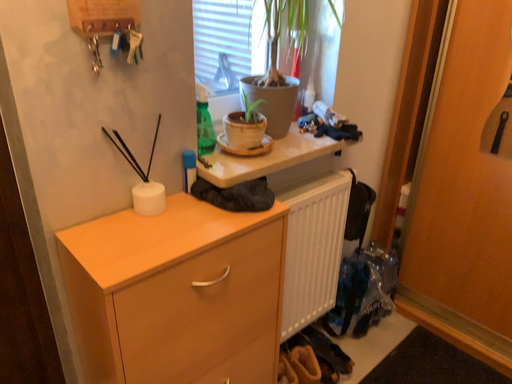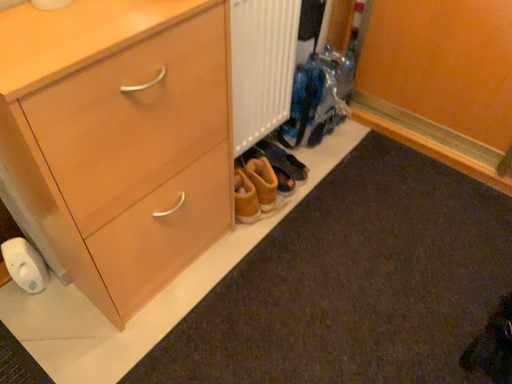
Question: Which way did the camera rotate in the video?

Choices:
 (A) rotated upward
 (B) rotated downward

Answer: (B)